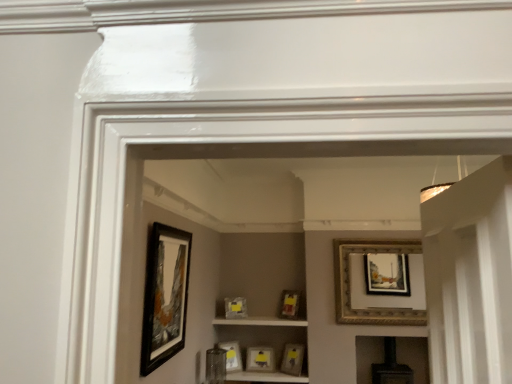
Question: Can you confirm if matte yellow picture frame at center, the sixth picture frame in the left-to-right sequence, is bigger than matte black picture frame at center, arranged as the 6th picture frame when viewed from the front?

Choices:
 (A) yes
 (B) no

Answer: (B)

Question: Is the position of matte yellow picture frame at center, the 3th picture frame positioned from the front, less distant than that of matte black picture frame at center, the 4th picture frame positioned from the left?

Choices:
 (A) yes
 (B) no

Answer: (A)

Question: Does matte yellow picture frame at center, the 3th picture frame positioned from the front, come behind matte black picture frame at center, arranged as the 6th picture frame when viewed from the front?

Choices:
 (A) yes
 (B) no

Answer: (B)

Question: Is there a large distance between matte yellow picture frame at center, positioned as the second picture frame in right-to-left order, and matte black picture frame at center, acting as the 4th picture frame starting from the right?

Choices:
 (A) yes
 (B) no

Answer: (B)

Question: Considering the relative sizes of matte yellow picture frame at center, positioned as the second picture frame in right-to-left order, and matte black picture frame at center, arranged as the 6th picture frame when viewed from the front, in the image provided, is matte yellow picture frame at center, positioned as the second picture frame in right-to-left order, shorter than matte black picture frame at center, arranged as the 6th picture frame when viewed from the front,?

Choices:
 (A) yes
 (B) no

Answer: (A)

Question: Is matte black picture frame at center, the 4th picture frame positioned from the left, located within matte yellow picture frame at center, the fifth picture frame from the back?

Choices:
 (A) no
 (B) yes

Answer: (A)

Question: Considering the relative sizes of matte yellow picture frame at center, the 3th picture frame positioned from the front, and matte black picture frame at center, which appears as the 4th picture frame when viewed from the front, in the image provided, is matte yellow picture frame at center, the 3th picture frame positioned from the front, shorter than matte black picture frame at center, which appears as the 4th picture frame when viewed from the front,?

Choices:
 (A) no
 (B) yes

Answer: (B)

Question: Is matte yellow picture frame at center, positioned as the second picture frame in right-to-left order, smaller than matte black picture frame at center, marked as the sixth picture frame in a right-to-left arrangement?

Choices:
 (A) no
 (B) yes

Answer: (A)

Question: Can you confirm if matte yellow picture frame at center, the fifth picture frame from the back, is thinner than matte black picture frame at center, the 4th picture frame viewed from the back?

Choices:
 (A) yes
 (B) no

Answer: (B)

Question: Does matte yellow picture frame at center, the fifth picture frame from the back, have a greater height compared to matte black picture frame at center, marked as the sixth picture frame in a right-to-left arrangement?

Choices:
 (A) yes
 (B) no

Answer: (B)

Question: From the image's perspective, does matte yellow picture frame at center, the 3th picture frame positioned from the front, appear lower than matte black picture frame at center, which appears as the 4th picture frame when viewed from the front?

Choices:
 (A) no
 (B) yes

Answer: (B)

Question: Does matte yellow picture frame at center, the fifth picture frame from the back, come in front of matte black picture frame at center, marked as the sixth picture frame in a right-to-left arrangement?

Choices:
 (A) no
 (B) yes

Answer: (B)

Question: From the image's perspective, does matte yellow picture frame at center, the 3th picture frame positioned from the front, appear higher than matte gold picture frame at center, the third picture frame in the right-to-left sequence?

Choices:
 (A) yes
 (B) no

Answer: (B)